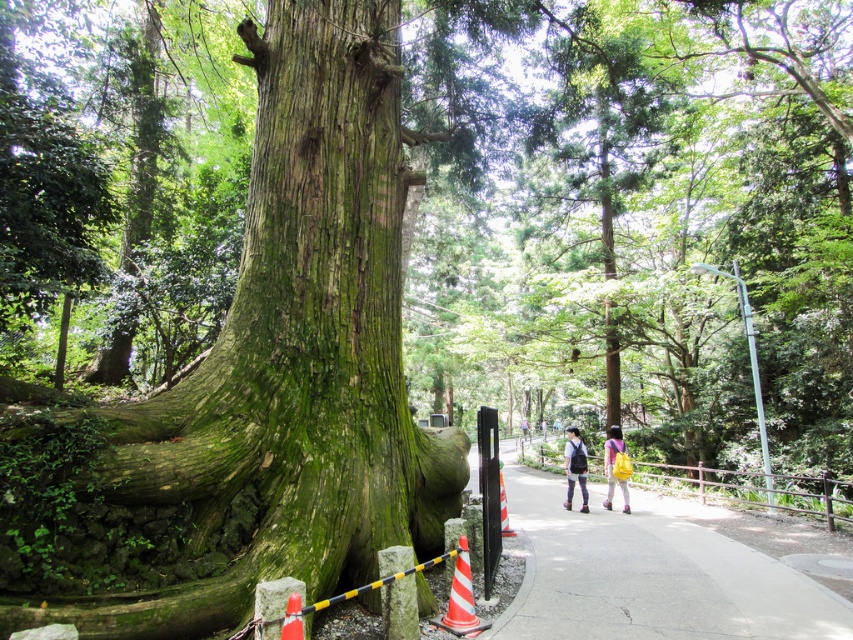
You are a hiker who has just arrived at the forest scene. You see the green rough bark tree trunk at center and the yellow backpack at center. Which object is positioned to the left?

The green rough bark tree trunk at center is positioned to the left of the yellow backpack at center.

You are standing on the pathway in the forest scene and want to determine which of the two points, point (567, 460) or point (604, 460), is nearer to you. Based on the scene description, which point is closer?

Point (567, 460) is closer to the viewer than point (604, 460).